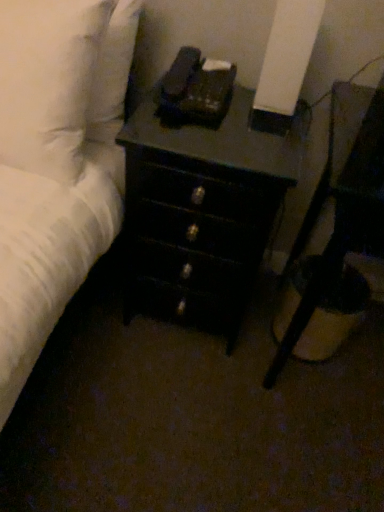
Where is `blank space above black wood chest of drawers at center (from a real-world perspective)`? The height and width of the screenshot is (512, 384). blank space above black wood chest of drawers at center (from a real-world perspective) is located at coordinates (223, 134).